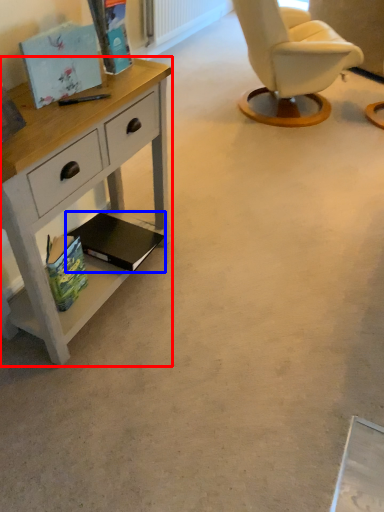
Question: Among these objects, which one is farthest to the camera, desk (highlighted by a red box) or magazine (highlighted by a blue box)?

Choices:
 (A) desk
 (B) magazine

Answer: (B)